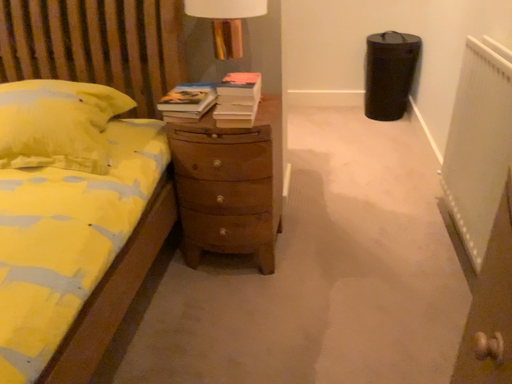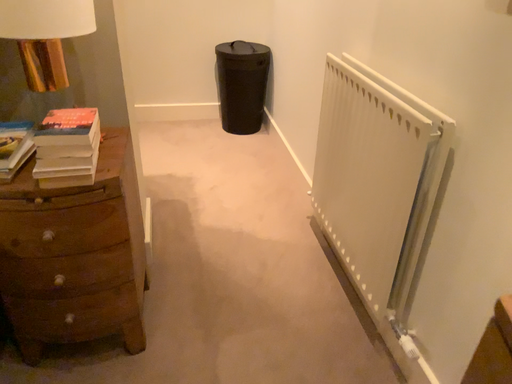
Question: How did the camera likely rotate when shooting the video?

Choices:
 (A) rotated left
 (B) rotated right

Answer: (B)